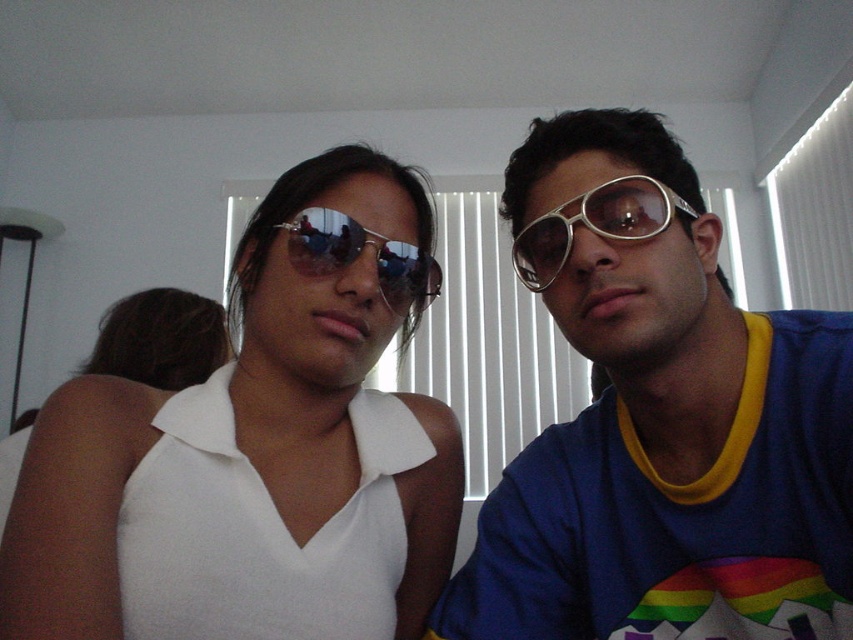
From the picture: You are standing in the room and want to reach the point marked as point (796, 483). If your arm can extend 25 inches, can you touch it without moving your feet?

The distance between you and point (796, 483) is 25.93 inches. Since your arm can only extend 25 inches, you cannot reach it without moving your feet.

You are a photographer setting up a shoot in this room. You notice two items at the center of the image, the metallic silver goggles at center and the sunglasses at center. Which of these two items has a greater width when viewed from the front?

The sunglasses at center are wider than the metallic silver goggles at center because the metallic silver goggles at center is thinner than sunglasses at center.

You are taking a photo of two people sitting on a couch. You notice two points in the image at coordinates point (601, 198) and point (294, 236). Which point is closer to the camera?

Point (601, 198) is closer to the camera than point (294, 236).